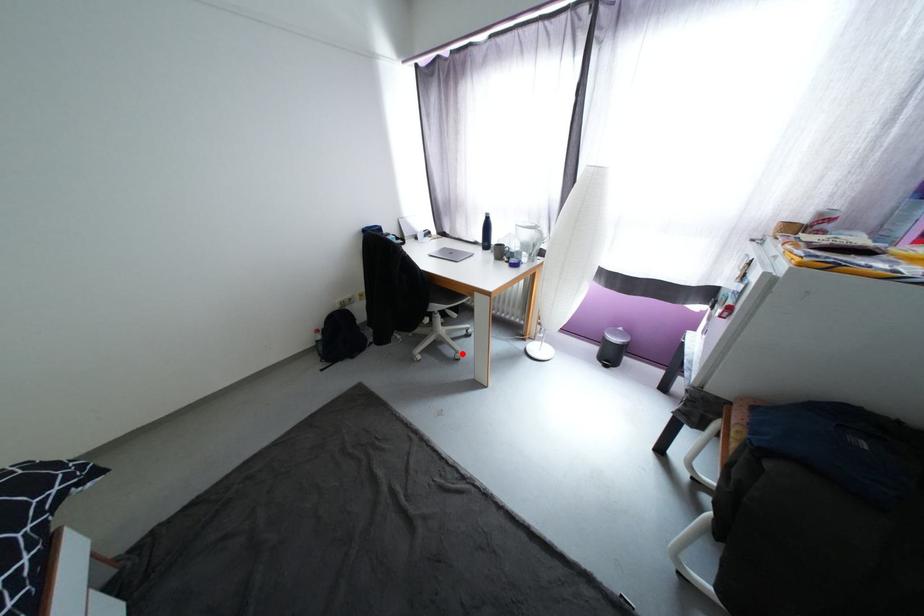
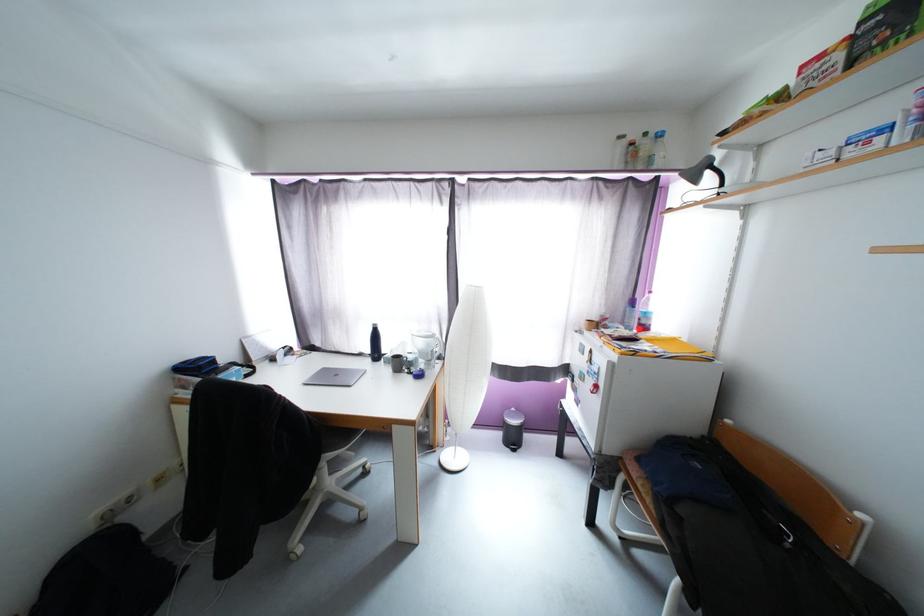
Question: I am providing you with two images of the same scene from different viewpoints. Image1 has a red point marked. In image2, the corresponding 3D location appears at what relative position? Reply with the corresponding letter.

Choices:
 (A) Closer
 (B) Farther

Answer: (A)